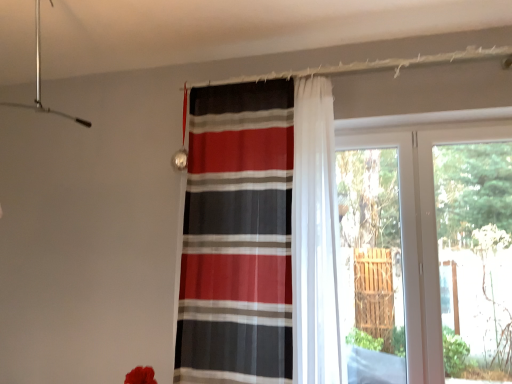
In order to face transparent glass screen door at right, should I rotate leftwards or rightwards?

You should rotate right by 16.186 degrees.

Measure the distance between transparent glass door at right and camera.

transparent glass door at right is 6.84 feet from camera.

At what (x,y) coordinates should I click in order to perform the action: click on striped fabric curtain at center. Please return your answer as a coordinate pair (x, y). This screenshot has height=384, width=512. Looking at the image, I should click on (259, 236).

Identify the location of transparent glass screen door at right. The width and height of the screenshot is (512, 384). click(378, 258).

Can you confirm if transparent glass screen door at right is bigger than transparent glass door at right?

No.

From the image's perspective, does transparent glass screen door at right appear higher than transparent glass door at right?

No, from the image's perspective, transparent glass screen door at right is not on top of transparent glass door at right.

Can you confirm if transparent glass screen door at right is taller than transparent glass door at right?

Correct, transparent glass screen door at right is much taller as transparent glass door at right.

Considering the relative sizes of transparent glass door at right and striped fabric curtain at center in the image provided, is transparent glass door at right shorter than striped fabric curtain at center?

Yes, transparent glass door at right is shorter than striped fabric curtain at center.

Which object is positioned more to the left, transparent glass door at right or striped fabric curtain at center?

striped fabric curtain at center.

Looking at their sizes, would you say transparent glass door at right is wider or thinner than striped fabric curtain at center?

Considering their sizes, transparent glass door at right looks slimmer than striped fabric curtain at center.

From the picture: Does transparent glass door at right turn towards striped fabric curtain at center?

No, transparent glass door at right is not facing towards striped fabric curtain at center.

Considering the points (192, 150) and (409, 344), which point is behind, point (192, 150) or point (409, 344)?

The point (192, 150) is more distant.

From a real-world perspective, which is physically below, striped fabric curtain at center or transparent glass screen door at right?

transparent glass screen door at right is physically lower.

Does striped fabric curtain at center have a larger size compared to transparent glass screen door at right?

Indeed, striped fabric curtain at center has a larger size compared to transparent glass screen door at right.

The image size is (512, 384). What are the coordinates of `window beneath the striped fabric curtain at center (from a real-world perspective)` in the screenshot? It's located at (422, 228).

Which of these two, striped fabric curtain at center or transparent glass door at right, is smaller?

With smaller size is transparent glass door at right.

Which is in front, point (211, 111) or point (405, 173)?

The point (211, 111) is more forward.

Does striped fabric curtain at center have a greater height compared to transparent glass door at right?

Yes, striped fabric curtain at center is taller than transparent glass door at right.

The height and width of the screenshot is (384, 512). I want to click on window above the transparent glass screen door at right (from a real-world perspective), so click(x=422, y=228).

Looking at this image, in terms of height, does transparent glass door at right look taller or shorter compared to transparent glass screen door at right?

Clearly, transparent glass door at right is shorter compared to transparent glass screen door at right.

Are transparent glass door at right and transparent glass screen door at right located far from each other?

No, there isn't a large distance between transparent glass door at right and transparent glass screen door at right.

From the image's perspective, is transparent glass door at right located above or below transparent glass screen door at right?

Clearly, from the image's perspective, transparent glass door at right is above transparent glass screen door at right.

Can you confirm if transparent glass screen door at right is thinner than striped fabric curtain at center?

Yes.

Are transparent glass screen door at right and striped fabric curtain at center far apart?

Actually, transparent glass screen door at right and striped fabric curtain at center are a little close together.

Which is closer to the camera, (380, 252) or (234, 127)?

Point (380, 252).

Locate an element on the screen. This screenshot has height=384, width=512. screen door below the transparent glass door at right (from the image's perspective) is located at coordinates (378, 258).

Where is `window below the striped fabric curtain at center (from a real-world perspective)`? window below the striped fabric curtain at center (from a real-world perspective) is located at coordinates (422, 228).

When comparing their distances from striped fabric curtain at center, does transparent glass screen door at right or transparent glass door at right seem further?

transparent glass door at right lies further to striped fabric curtain at center than the other object.

Which object lies nearer to the anchor point transparent glass screen door at right, transparent glass door at right or striped fabric curtain at center?

Based on the image, transparent glass door at right appears to be nearer to transparent glass screen door at right.

Which object lies further to the anchor point transparent glass screen door at right, striped fabric curtain at center or transparent glass door at right?

The object further to transparent glass screen door at right is striped fabric curtain at center.

Considering their positions, is striped fabric curtain at center positioned further to transparent glass door at right than transparent glass screen door at right?

The object further to transparent glass door at right is striped fabric curtain at center.

When comparing their distances from striped fabric curtain at center, does transparent glass door at right or transparent glass screen door at right seem closer?

transparent glass screen door at right is closer to striped fabric curtain at center.

Looking at the image, which one is located closer to transparent glass door at right, transparent glass screen door at right or striped fabric curtain at center?

Based on the image, transparent glass screen door at right appears to be nearer to transparent glass door at right.

At what (x,y) coordinates should I click in order to perform the action: click on screen door situated between striped fabric curtain at center and transparent glass door at right from left to right. Please return your answer as a coordinate pair (x, y). This screenshot has height=384, width=512. Looking at the image, I should click on (378, 258).